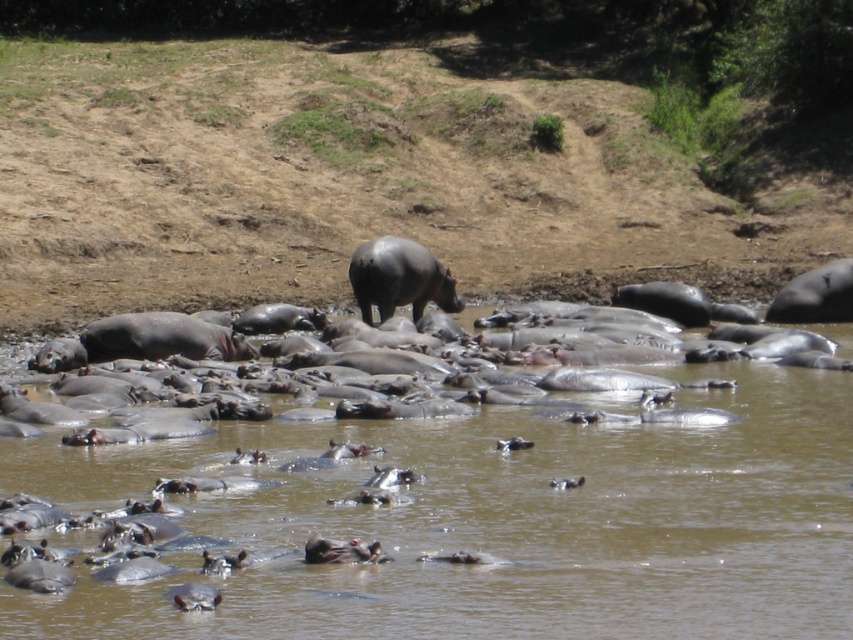
You are observing a group of hippos in a water body. You see a brown matte hippopotamus at center and a gray matte hippo at center. Which hippo is located to the right of the other?

The brown matte hippopotamus at center is positioned on the right side of gray matte hippo at center.

You are a wildlife photographer observing the hippos in the water. You want to capture a photo where the gray matte hippo at center is clearly visible above the gray matte hippo at right. Based on their sizes, is this possible?

Yes, the gray matte hippo at center is taller than the gray matte hippo at right, so it can be positioned to be visible above it in the photo.